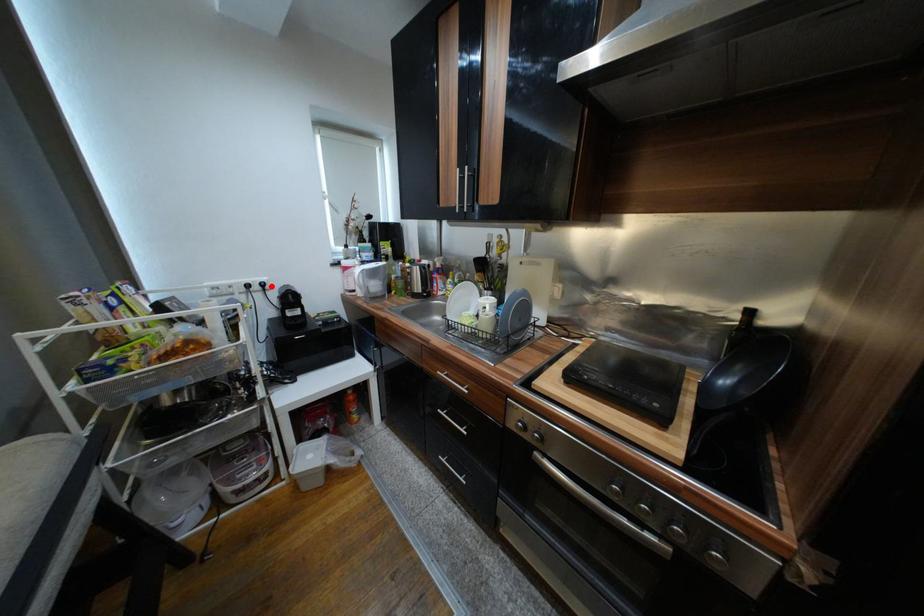
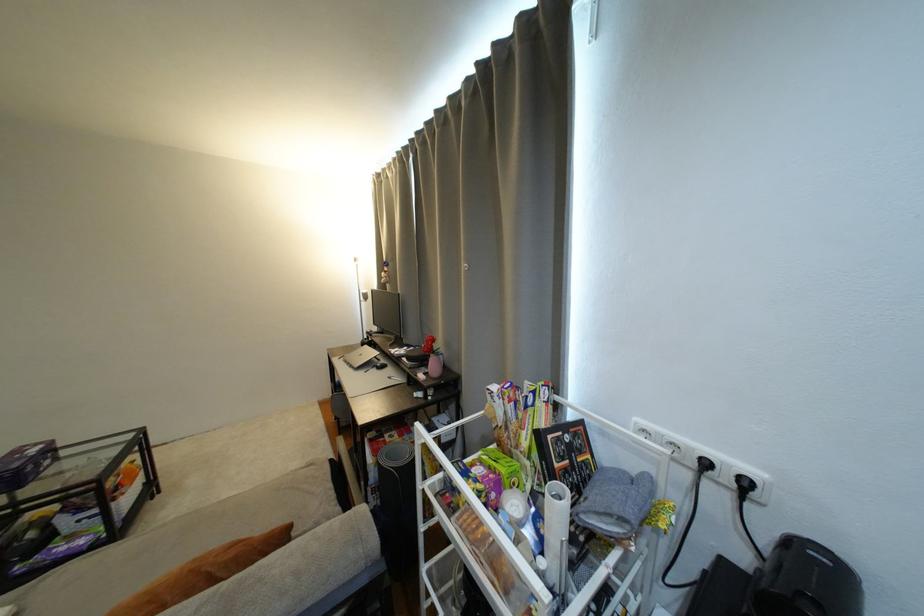
In the second image, find the point that corresponds to the highlighted location in the first image.

(754, 485)